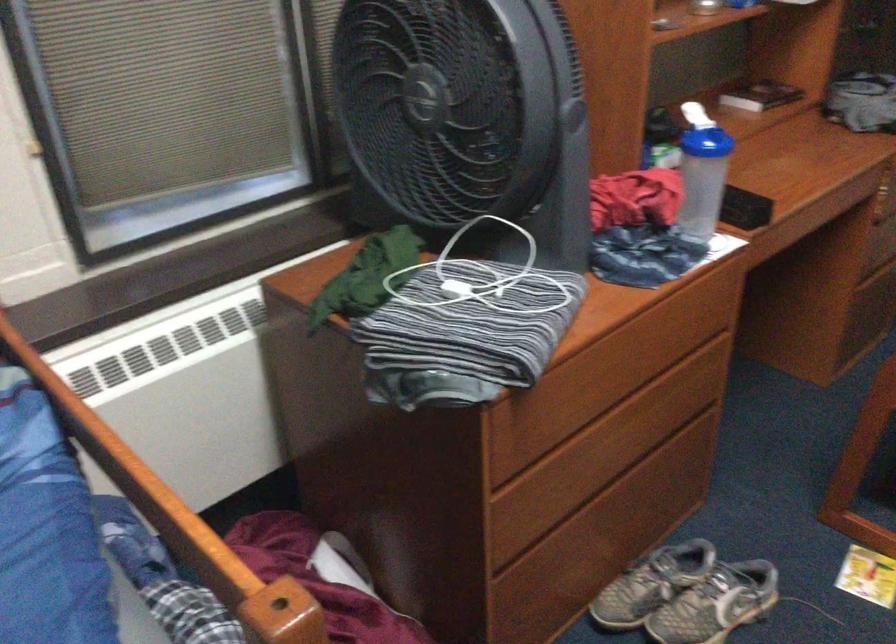
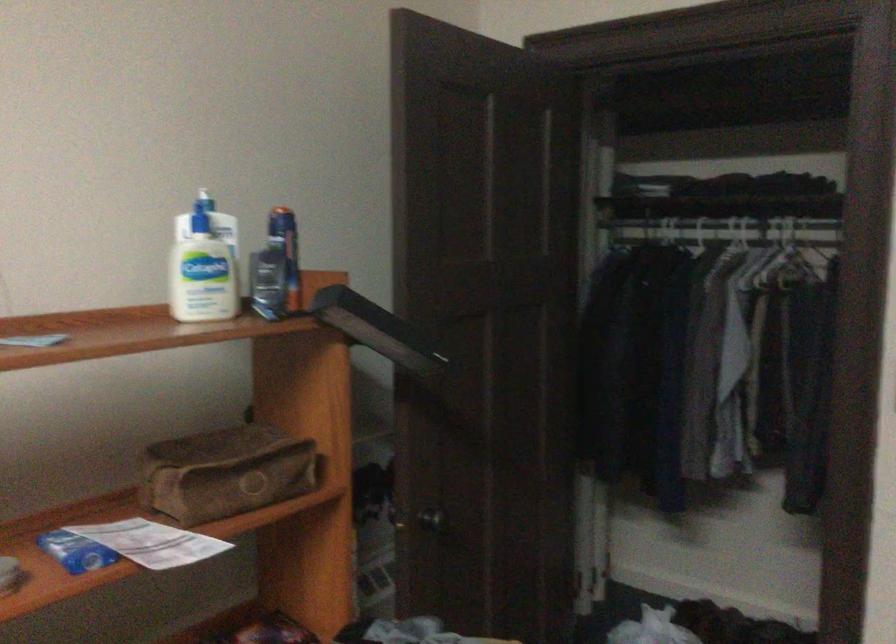
In a continuous first-person perspective shot, in which direction is the camera moving?

The cameraman walked toward right, forward.